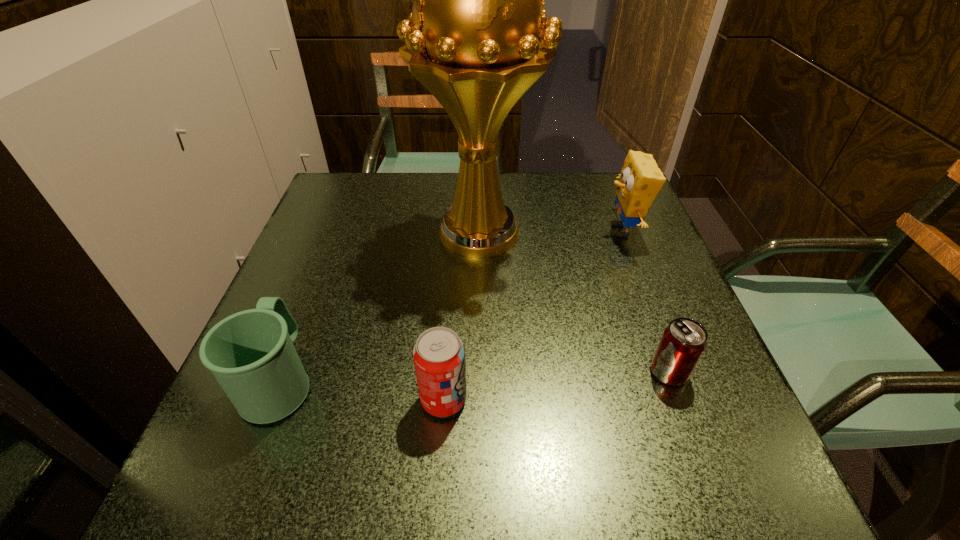
This screenshot has width=960, height=540. I want to click on vacant region located 0.060m on the front of the left pop soda, so click(440, 458).

At what (x,y) coordinates should I click in order to perform the action: click on vacant space situated 0.080m on the side of the mug with the handle. Please return your answer as a coordinate pair (x, y). Looking at the image, I should click on (308, 308).

Identify the location of free space located 0.300m on the side of the mug with the handle. Image resolution: width=960 pixels, height=540 pixels. (335, 239).

Locate an element on the screen. The width and height of the screenshot is (960, 540). blank space located on the side of the mug with the handle is located at coordinates (331, 250).

Locate an element on the screen. The image size is (960, 540). vacant area situated 0.180m on the front of the shorter pop soda is located at coordinates (717, 501).

Where is `trophy_cup that is at the far edge`? trophy_cup that is at the far edge is located at coordinates (472, 39).

I want to click on sponge that is at the far edge, so pos(640,181).

Find the location of a particular element. The height and width of the screenshot is (540, 960). object at the left edge is located at coordinates (251, 354).

Locate an element on the screen. Image resolution: width=960 pixels, height=540 pixels. sponge present at the right edge is located at coordinates (640, 181).

You are a GUI agent. You are given a task and a screenshot of the screen. Output one action in this format:
    pyautogui.click(x=<x>, y=<y>)
    Task: Click on the pop soda present at the right edge
    
    Given the screenshot: What is the action you would take?
    pyautogui.click(x=683, y=342)